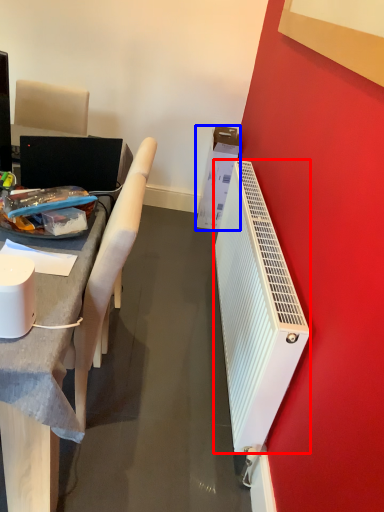
Question: Which object is further to the camera taking this photo, radiator (highlighted by a red box) or box (highlighted by a blue box)?

Choices:
 (A) radiator
 (B) box

Answer: (B)